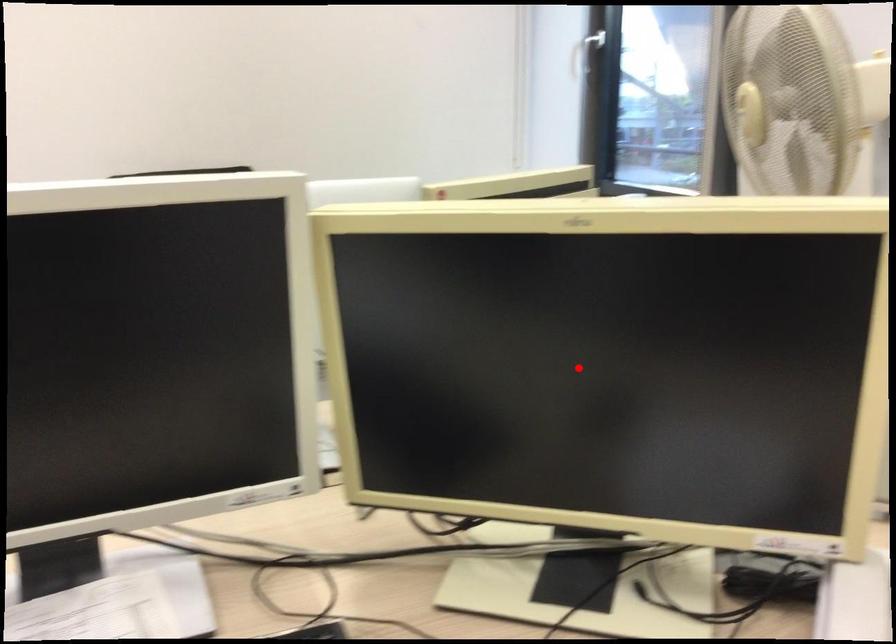
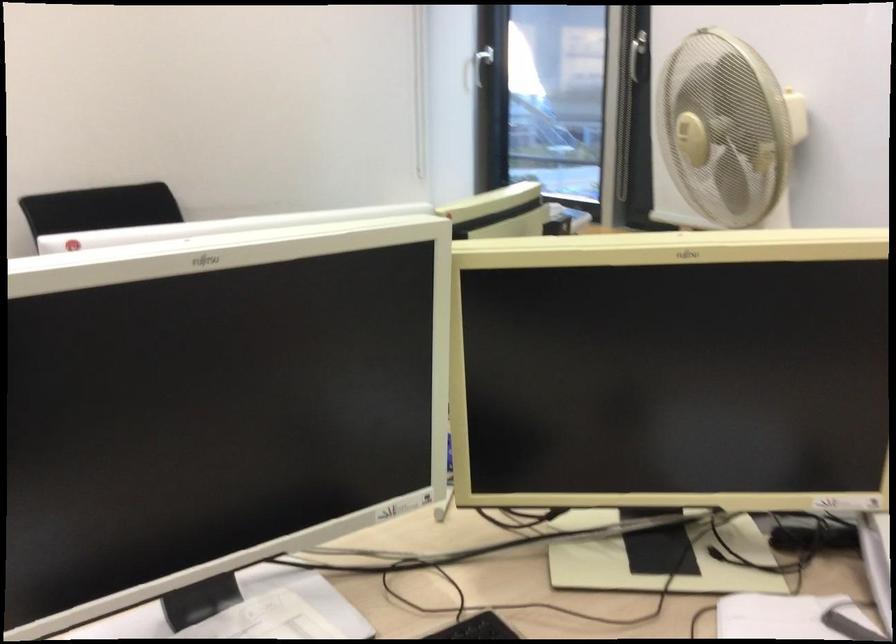
Find the pixel in the second image that matches the highlighted location in the first image.

(673, 371)